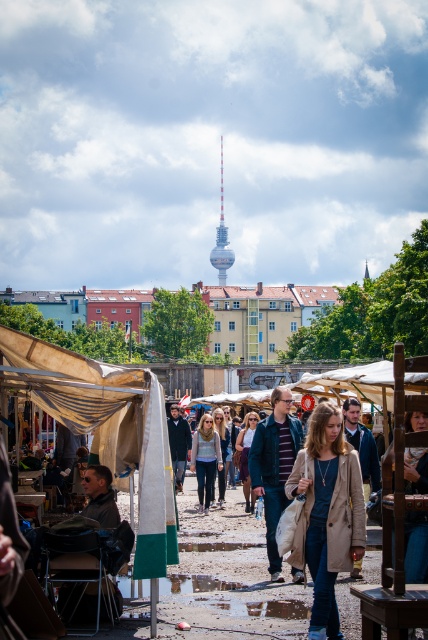
You are a customer at the market and want to reach the light beige coat at center. However, there is a beige canvas tent at center in your way. Can you walk directly to the coat without going around the tent?

The beige canvas tent at center is located above the light beige coat at center, so you can walk directly to the coat without going around the tent since the tent is positioned above it and not blocking the path.

Consider the image. You are a photographer setting up a tripod in the center of the market. You notice a person wearing a blue denim jacket at center and another wearing a matte gray sweater at center. To ensure both subjects are in frame, which direction should you position the tripod relative to the jackets?

The blue denim jacket at center might be wider than the matte gray sweater at center, so positioning the tripod slightly to the side of the wider jacket could help include both subjects in the frame.